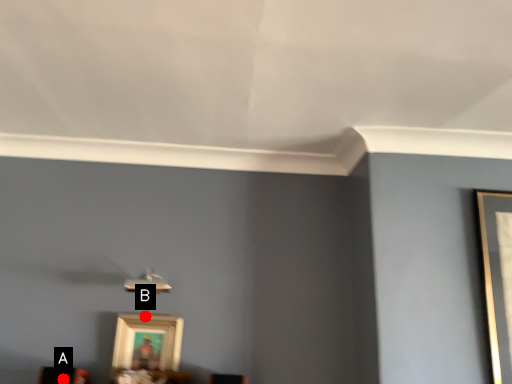
Question: Two points are circled on the image, labeled by A and B beside each circle. Which point is closer to the camera taking this photo?

Choices:
 (A) A is closer
 (B) B is closer

Answer: (A)